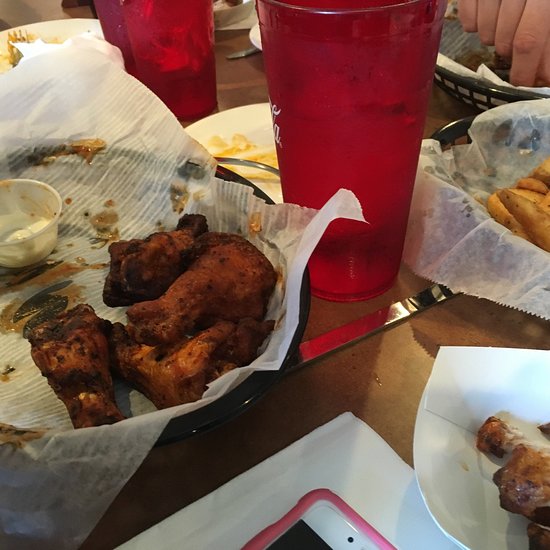
The image size is (550, 550). Identify the location of part of some silverware. (251, 161).